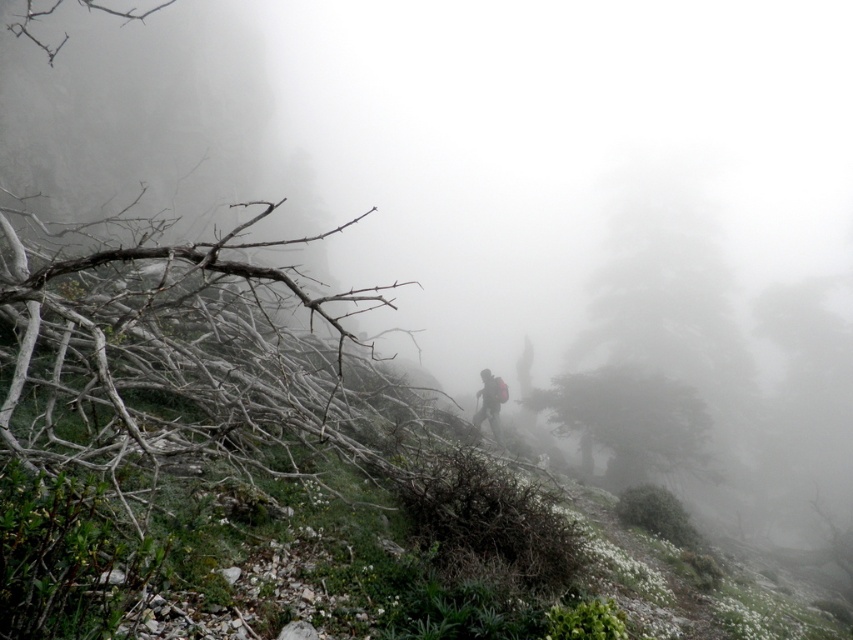
You are a hiker navigating through the misty mountain terrain. You notice a point marked at coordinates (659, 349). Based on the scene, where is this point located?

The point at (659, 349) is on the dark green textured tree at center, so it is located on the central tree in the misty mountain landscape.

You are a hiker in the misty mountain scene. You have a dark gray fabric backpack at center and see a dark green textured tree at center. Which object is positioned to the right of the other?

The dark green textured tree at center is to the right of the dark gray fabric backpack at center.

You are a hiker trying to navigate through the misty mountains. You see a green matte tree at center and a dark gray fabric backpack at center. Which object is wider?

The green matte tree at center is wider than the dark gray fabric backpack at center.